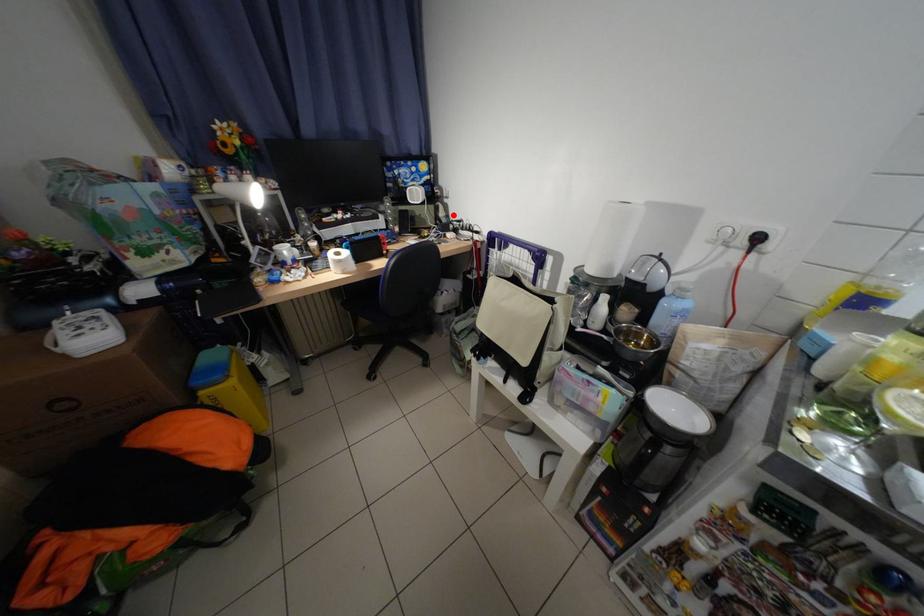
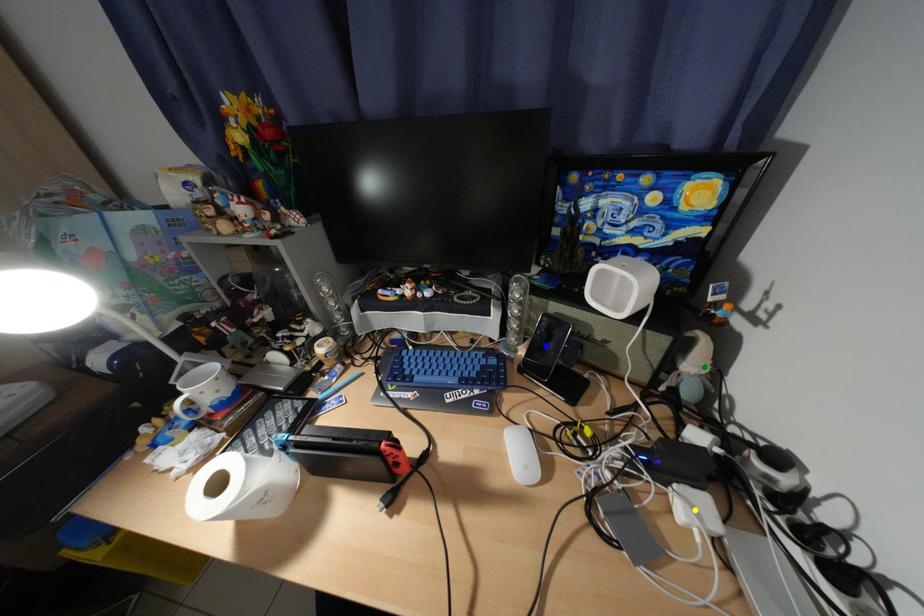
Question: I am providing you with two images of the same scene from different viewpoints. A red point is marked on the first image. You are given multiple points on the second image. Which point in image 2 represents the same 3d spot as the red point in image 1?

Choices:
 (A) green point
 (B) yellow point
 (C) blue point

Answer: (A)